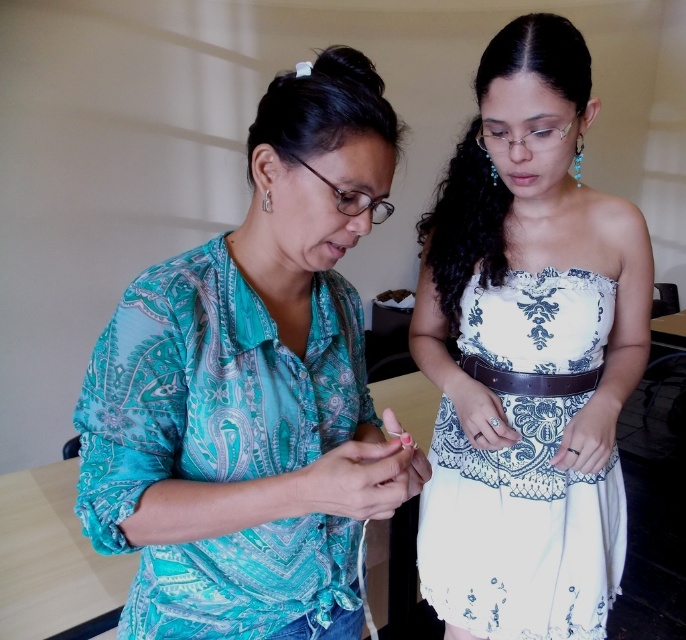
Question: Is teal printed blouse at left thinner than white lace dress at center?

Choices:
 (A) no
 (B) yes

Answer: (B)

Question: Is teal printed blouse at left in front of white lace dress at center?

Choices:
 (A) no
 (B) yes

Answer: (B)

Question: Among these objects, which one is farthest from the camera?

Choices:
 (A) white lace dress at center
 (B) teal printed blouse at left

Answer: (A)

Question: Is white lace dress at center to the left of silver metallic earring at upper left from the viewer's perspective?

Choices:
 (A) yes
 (B) no

Answer: (B)

Question: Estimate the real-world distances between objects in this image. Which object is farther from the silver metallic earring at upper left?

Choices:
 (A) teal printed blouse at left
 (B) white lace dress at center

Answer: (B)

Question: Which object is positioned farthest from the teal printed blouse at left?

Choices:
 (A) white lace dress at center
 (B) silver metallic earring at upper left

Answer: (A)